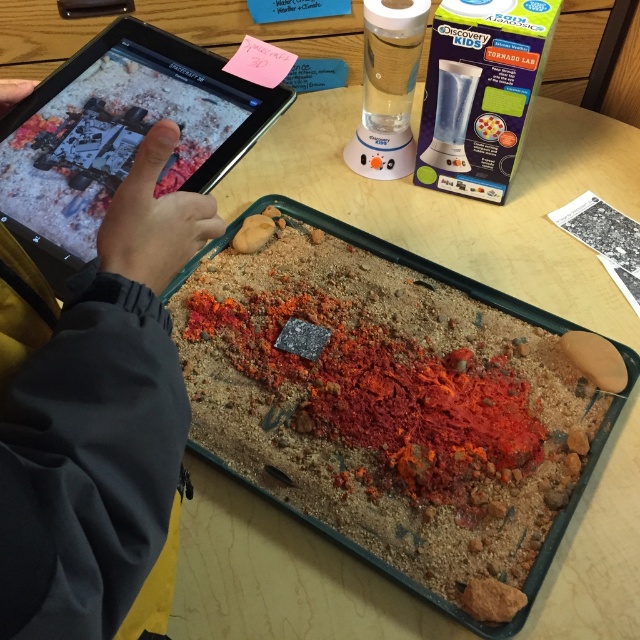
You are a participant in the science fair and need to place a small model volcano next to the granular sand tray at center. The gray fabric hand at upper left is currently blocking the space. Can you move the hand to the right to make room for the volcano?

The gray fabric hand at upper left is to the left of the granular sand tray at center. Moving the hand to the right would place it beside the tray, creating space for the volcano model.

You are a student participating in a science fair activity. You need to place a small model of a volcano next to the black glossy tablet at upper left and the granular sand tray at center. Which object should you place it closer to if you want it to be visible over the tablet but not block the sand tray?

You should place the volcano model closer to the black glossy tablet at upper left because it has a lesser height than the granular sand tray at center, so placing it near the lower tablet would allow it to be visible over it while avoiding blocking the taller sand tray.